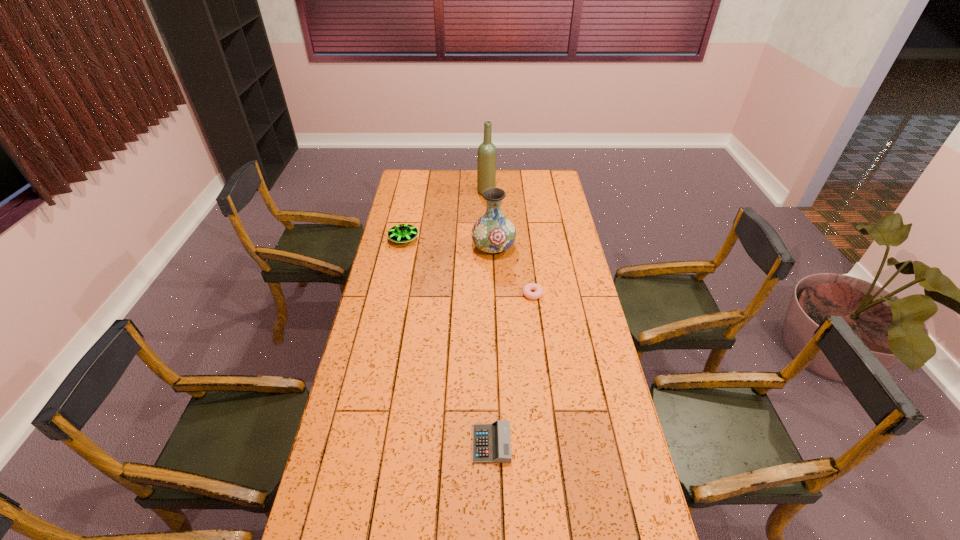
Identify the location of wine bottle. This screenshot has height=540, width=960. 486,163.

Identify the location of the tallest object. The height and width of the screenshot is (540, 960). (486, 163).

This screenshot has height=540, width=960. In order to click on vase in this screenshot , I will do `click(493, 233)`.

Locate an element on the screen. The height and width of the screenshot is (540, 960). the third tallest object is located at coordinates (402, 233).

Image resolution: width=960 pixels, height=540 pixels. I want to click on saucer, so click(x=402, y=233).

Image resolution: width=960 pixels, height=540 pixels. I want to click on calculator, so click(491, 442).

Identify the location of the rightmost object. (527, 289).

Where is `the fourth farthest object`? The image size is (960, 540). the fourth farthest object is located at coordinates (527, 289).

You are a GUI agent. You are given a task and a screenshot of the screen. Output one action in this format:
    pyautogui.click(x=<x>, y=<y>)
    Task: Click on the vacant region located on the front of the wine bottle
    This screenshot has height=540, width=960.
    Given the screenshot: What is the action you would take?
    pyautogui.click(x=488, y=243)

Find the location of `free location located 0.110m on the front of the vase`. free location located 0.110m on the front of the vase is located at coordinates (494, 278).